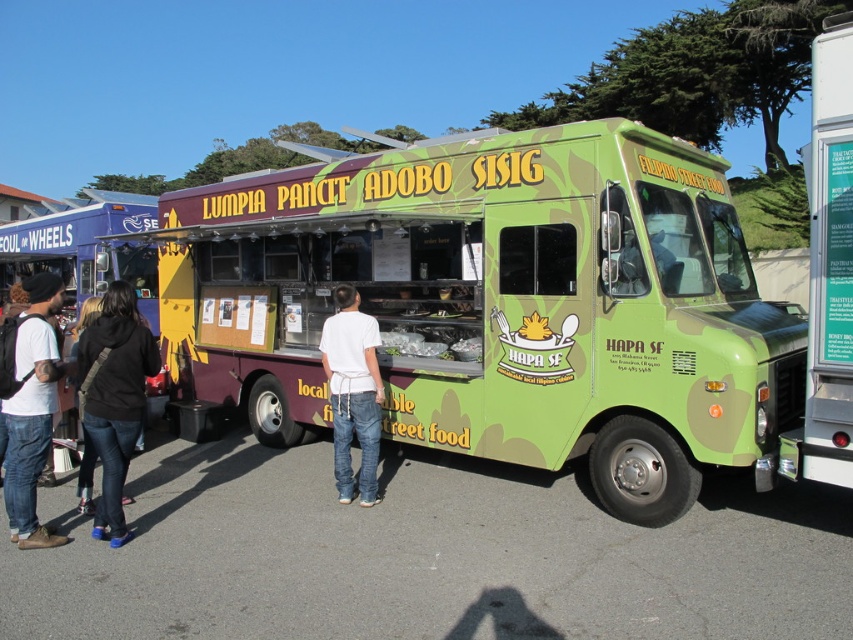
You are standing at the black denim jeans at lower left and want to reach the

The distance between the black denim jeans at lower left and the is 4.71 meters, so you can reach the by walking forward approximately 4.71 meters from the black denim jeans at lower left.

You are a customer standing in front of the green matte food truck at center and the white cotton shirt at center. Which object is smaller in size?

The green matte food truck at center is smaller in size compared to the white cotton shirt at center.